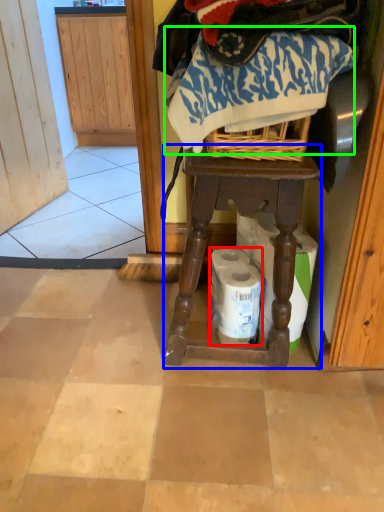
Question: Based on their relative distances, which object is nearer to toilet paper (highlighted by a red box)? Choose from furniture (highlighted by a blue box) and clothing (highlighted by a green box).

Choices:
 (A) furniture
 (B) clothing

Answer: (A)